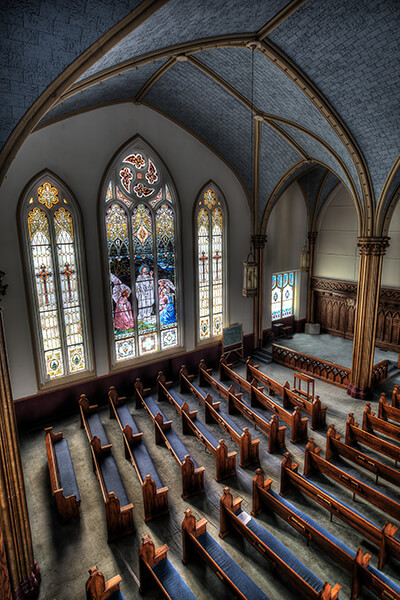
In order to click on wall in this screenshot , I will do `click(338, 302)`.